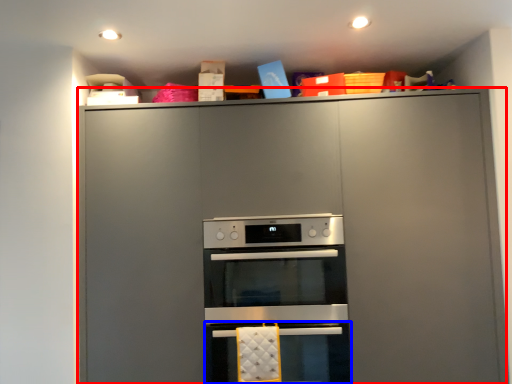
Question: Which of the following is the farthest to the observer, cabinetry (highlighted by a red box) or oven (highlighted by a blue box)?

Choices:
 (A) cabinetry
 (B) oven

Answer: (B)